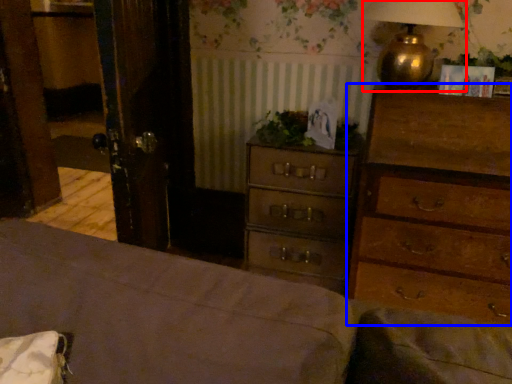
Question: Which object appears farthest to the camera in this image, table lamp (highlighted by a red box) or chest of drawers (highlighted by a blue box)?

Choices:
 (A) table lamp
 (B) chest of drawers

Answer: (A)